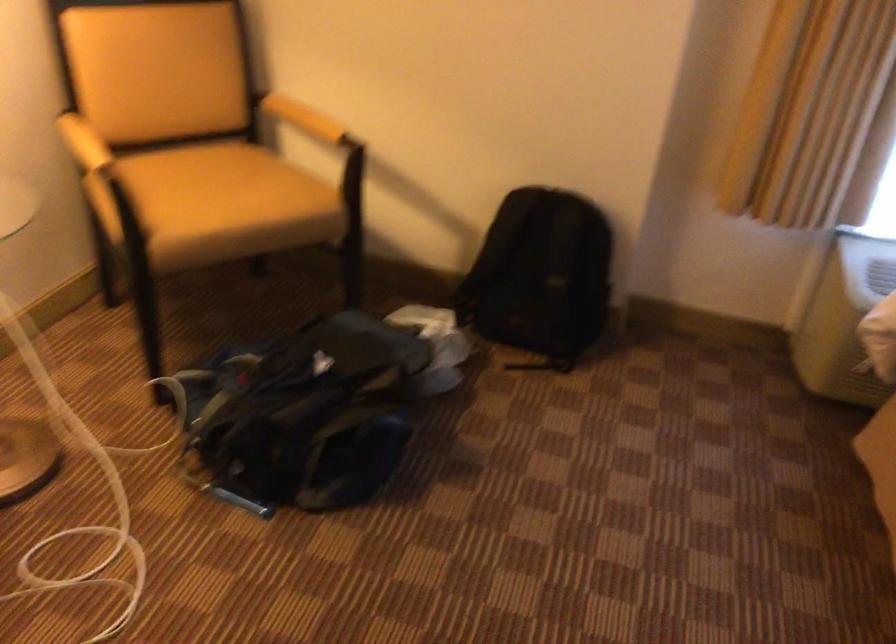
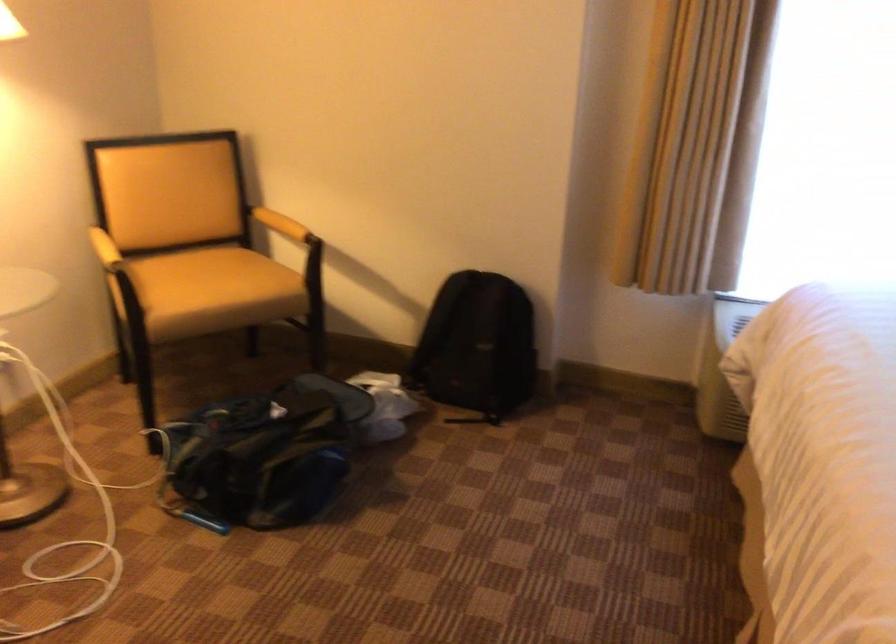
Question: Based on the continuous images, in which direction is the camera rotating? Reply with the corresponding letter.

Choices:
 (A) Left
 (B) Right
 (C) Up
 (D) Down

Answer: (C)